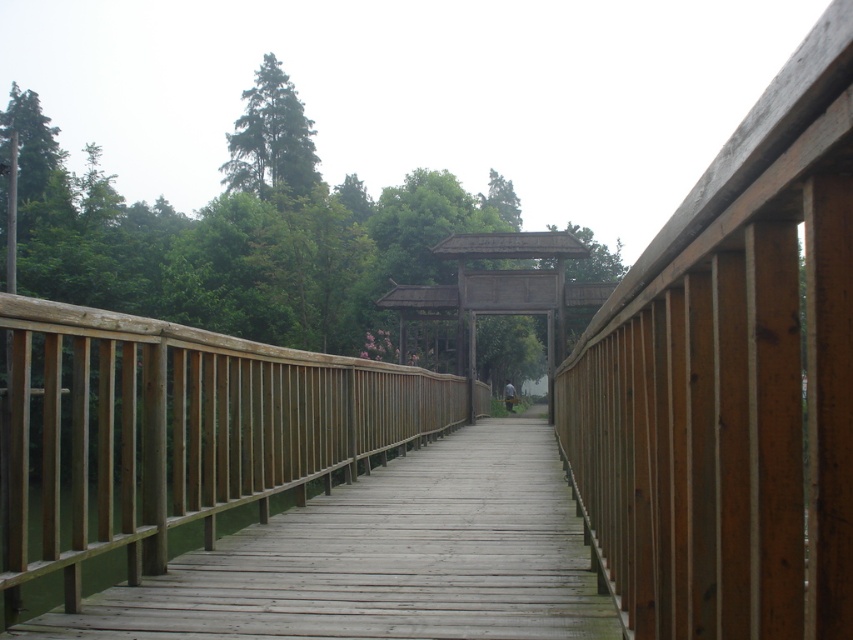
Question: Does wooden gate at center appear under green matte tree at upper center?

Choices:
 (A) no
 (B) yes

Answer: (B)

Question: Which of the following is the closest to the observer?

Choices:
 (A) (567, 243)
 (B) (474, 547)

Answer: (B)

Question: Can you confirm if wooden at center is smaller than wooden gate at center?

Choices:
 (A) yes
 (B) no

Answer: (A)

Question: Which of the following is the closest to the observer?

Choices:
 (A) (419, 305)
 (B) (273, 109)
 (C) (434, 536)

Answer: (C)

Question: Which of these objects is positioned closest to the wooden at center?

Choices:
 (A) green matte tree at upper center
 (B) wooden gate at center

Answer: (B)

Question: Can you confirm if wooden gate at center is positioned below green matte tree at upper center?

Choices:
 (A) yes
 (B) no

Answer: (A)